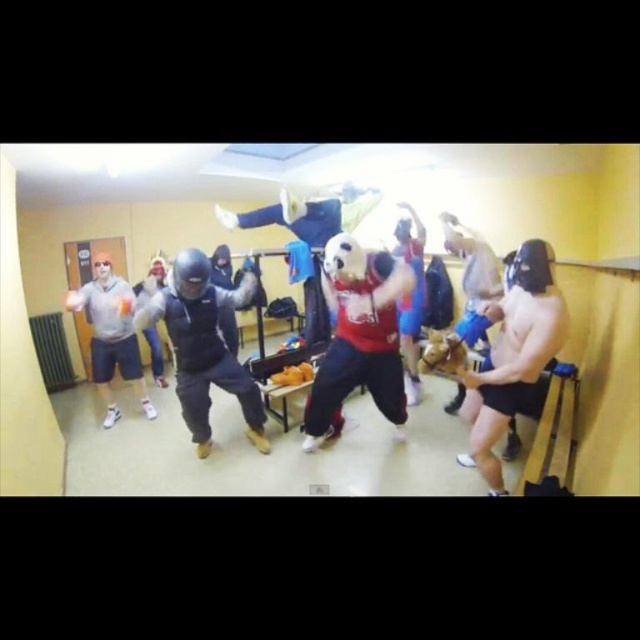
Question: Considering the relative positions of shiny metallic helmet at right and black matte hoodie at center in the image provided, where is shiny metallic helmet at right located with respect to black matte hoodie at center?

Choices:
 (A) above
 (B) below

Answer: (B)

Question: Based on their relative distances, which object is nearer to the shiny metallic helmet at right?

Choices:
 (A) matte gray hoodie at left
 (B) black matte hoodie at center

Answer: (B)

Question: Which point appears farthest from the camera in this image?

Choices:
 (A) (221, 346)
 (B) (68, 304)

Answer: (B)

Question: Does black matte hoodie at center have a larger size compared to matte gray hoodie at left?

Choices:
 (A) no
 (B) yes

Answer: (B)

Question: Considering the real-world distances, which object is farthest from the matte gray hoodie at left?

Choices:
 (A) shiny metallic helmet at right
 (B) black matte hoodie at center

Answer: (A)

Question: Where is shiny metallic helmet at right located in relation to matte gray hoodie at left in the image?

Choices:
 (A) above
 (B) below

Answer: (A)